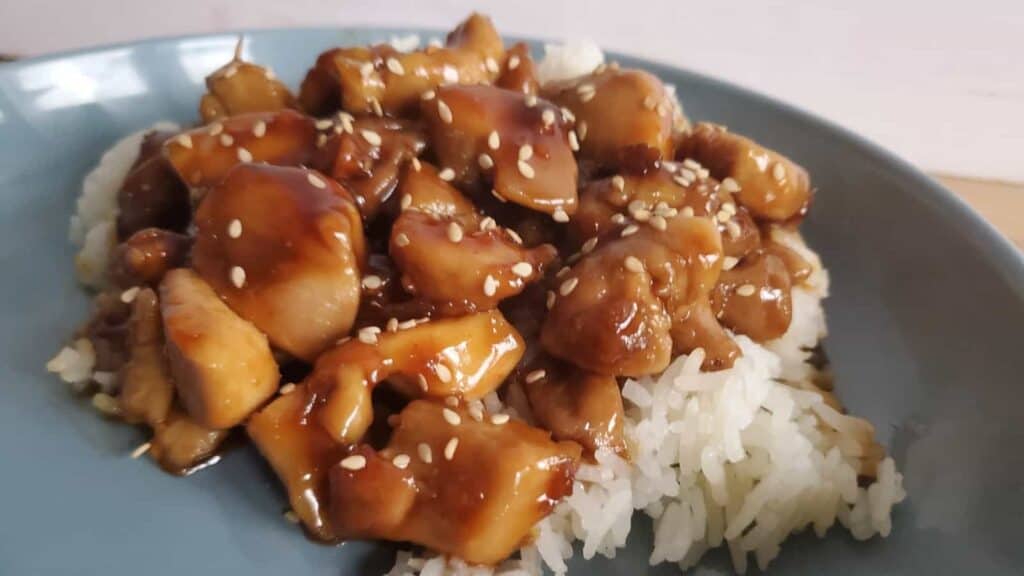
You are a GUI agent. You are given a task and a screenshot of the screen. Output one action in this format:
    pyautogui.click(x=<x>, y=<y>)
    Task: Click on the white wall
    
    Given the screenshot: What is the action you would take?
    pyautogui.click(x=949, y=60)